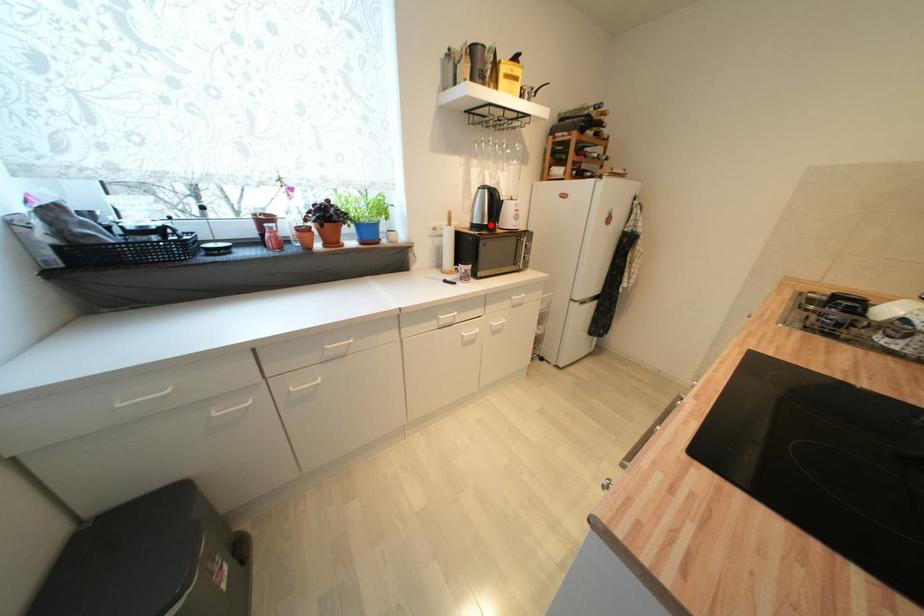
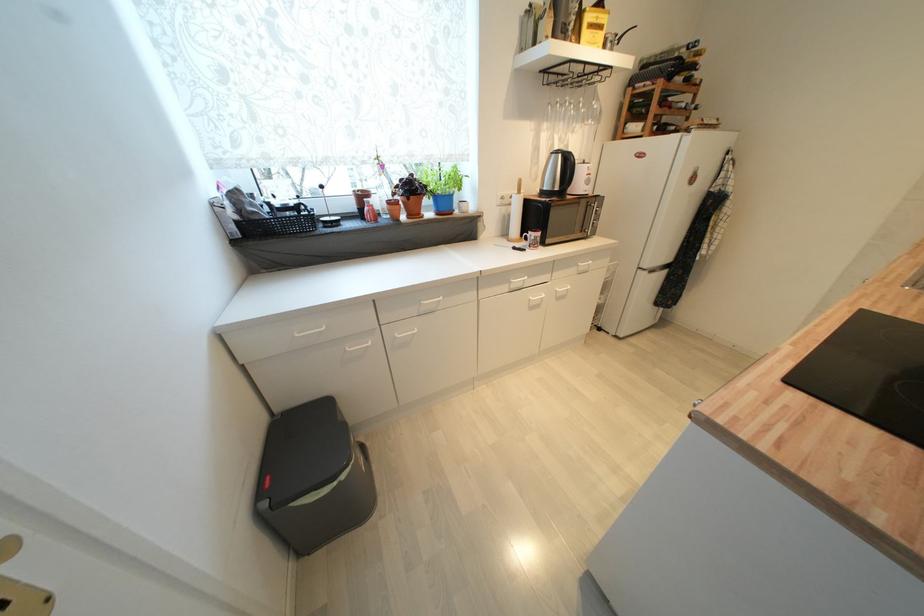
Find the pixel in the second image that matches the highlighted location in the first image.

(562, 191)